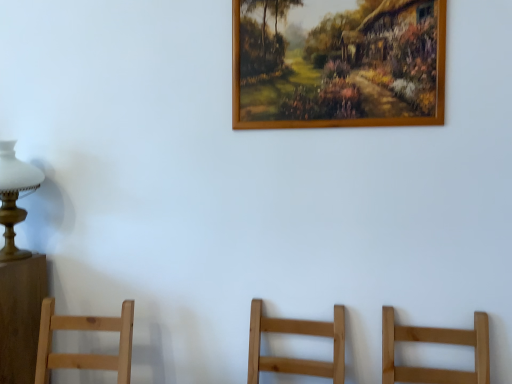
Question: Is wooden picture frame at upper center at the back of matte white glass at left?

Choices:
 (A) yes
 (B) no

Answer: (B)

Question: Is matte white glass at left placed right next to wooden picture frame at upper center?

Choices:
 (A) yes
 (B) no

Answer: (B)

Question: Considering the relative sizes of matte white glass at left and wooden picture frame at upper center in the image provided, is matte white glass at left smaller than wooden picture frame at upper center?

Choices:
 (A) no
 (B) yes

Answer: (A)

Question: Can you confirm if matte white glass at left is taller than wooden picture frame at upper center?

Choices:
 (A) no
 (B) yes

Answer: (A)

Question: Is matte white glass at left further to the viewer compared to wooden picture frame at upper center?

Choices:
 (A) yes
 (B) no

Answer: (A)

Question: Is matte white glass at left to the right of wooden picture frame at upper center from the viewer's perspective?

Choices:
 (A) no
 (B) yes

Answer: (A)

Question: Is wooden picture frame at upper center oriented towards matte white glass at left?

Choices:
 (A) yes
 (B) no

Answer: (B)

Question: From a real-world perspective, is wooden picture frame at upper center positioned over matte white glass at left based on gravity?

Choices:
 (A) no
 (B) yes

Answer: (B)

Question: From the image's perspective, would you say wooden picture frame at upper center is positioned over matte white glass at left?

Choices:
 (A) no
 (B) yes

Answer: (B)

Question: Is wooden picture frame at upper center completely or partially outside of matte white glass at left?

Choices:
 (A) no
 (B) yes

Answer: (B)

Question: From a real-world perspective, is wooden picture frame at upper center beneath matte white glass at left?

Choices:
 (A) no
 (B) yes

Answer: (A)

Question: Are wooden picture frame at upper center and matte white glass at left located far from each other?

Choices:
 (A) no
 (B) yes

Answer: (B)

Question: Considering the positions of point (3, 185) and point (421, 23), is point (3, 185) closer or farther from the camera than point (421, 23)?

Choices:
 (A) closer
 (B) farther

Answer: (B)